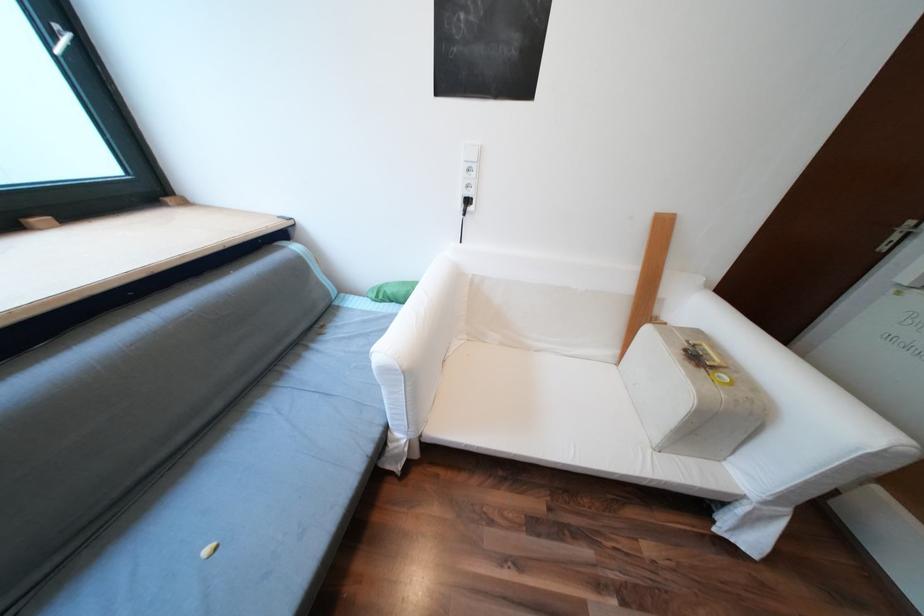
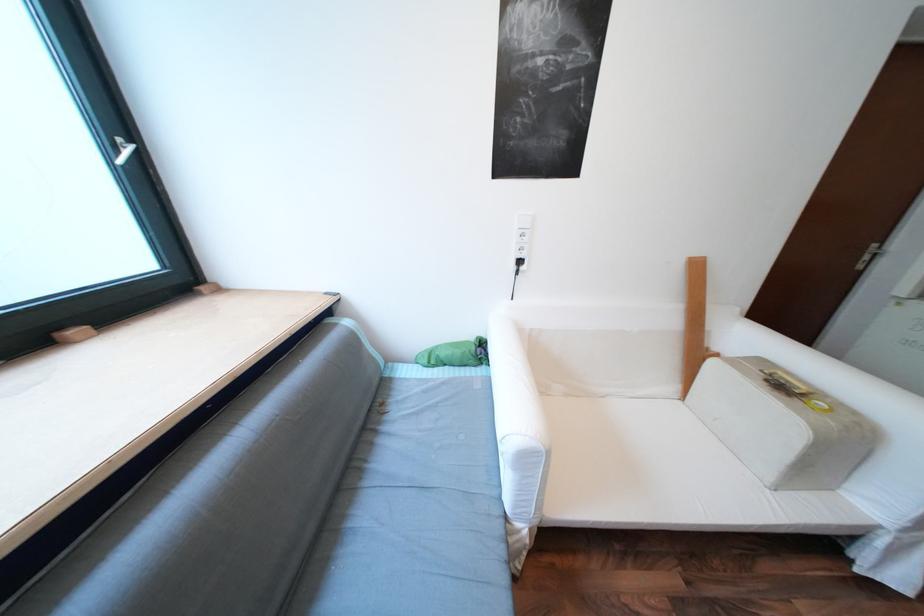
Question: How did the camera likely rotate?

Choices:
 (A) Left
 (B) Right
 (C) Up
 (D) Down

Answer: (C)